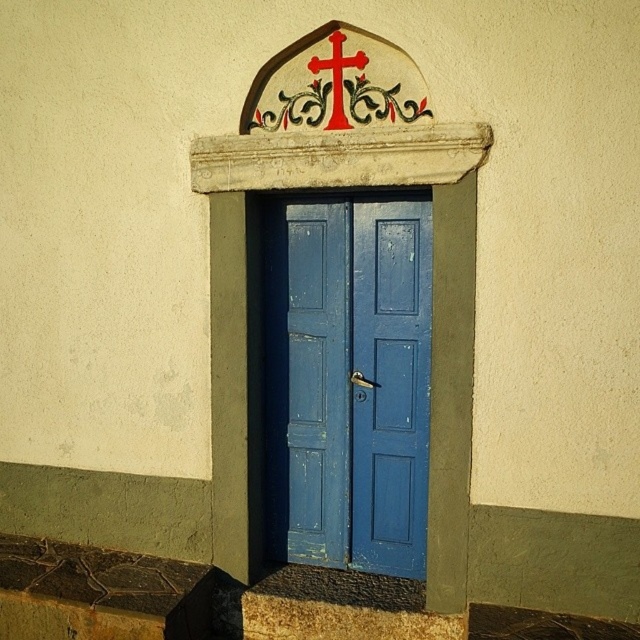
You are standing in front of the building and want to enter through the entrance. Which object should you approach first, the blue wooden door at center or the red painted wood cross at upper center?

You should approach the blue wooden door at center first because it is to the right of the red painted wood cross at upper center, making it closer to your position in front of the building.